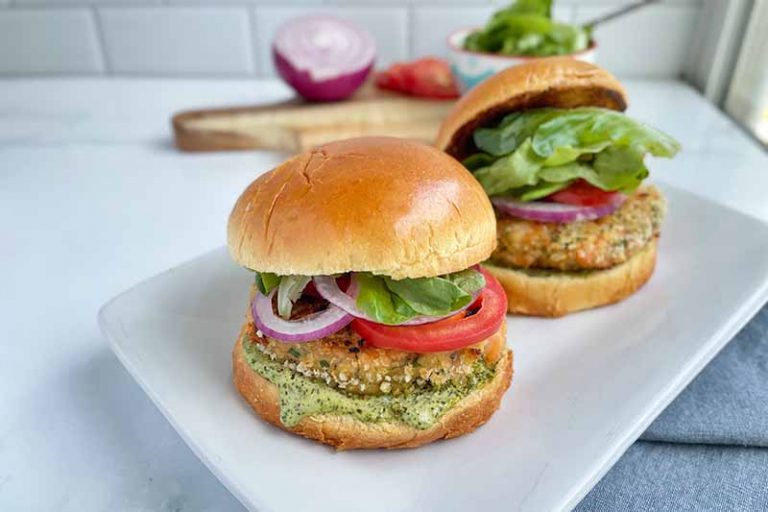
Where is `bowl with white and blue`? The image size is (768, 512). bowl with white and blue is located at coordinates (472, 69).